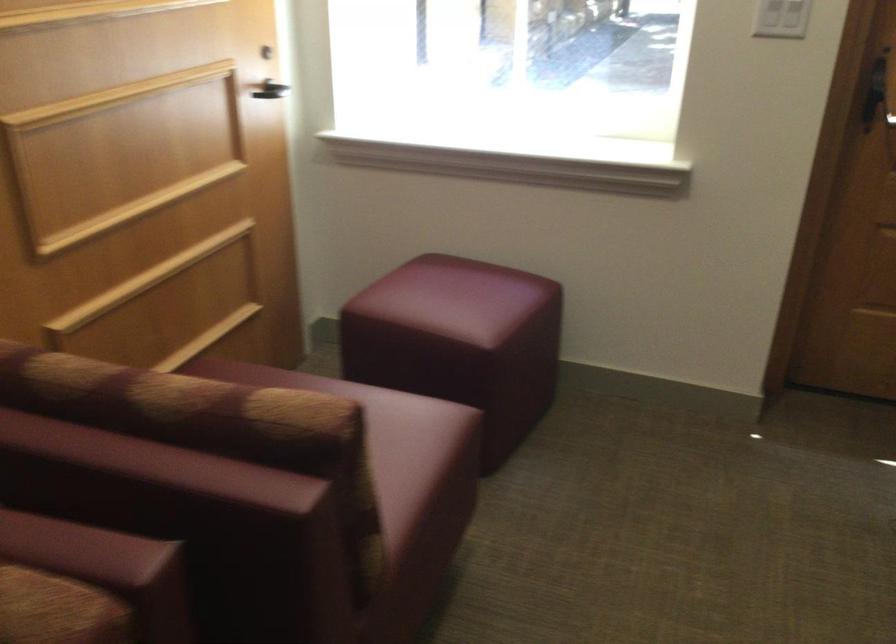
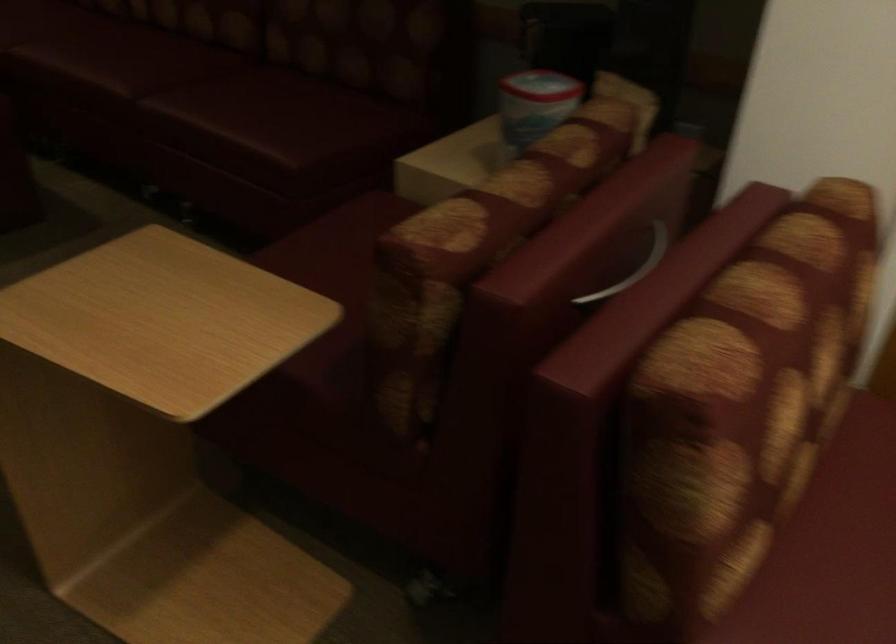
How did the camera likely rotate?

The rotation direction of the camera is left-down.